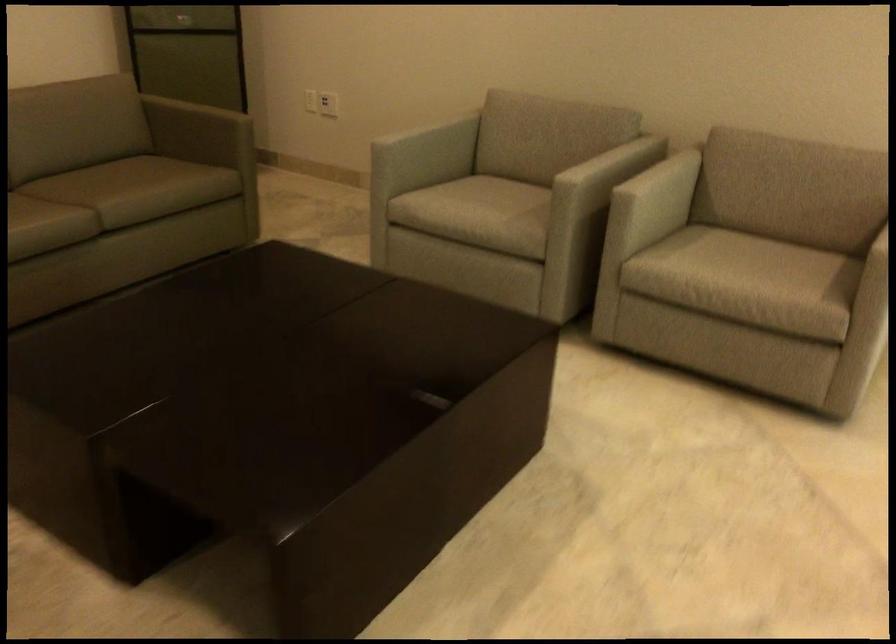
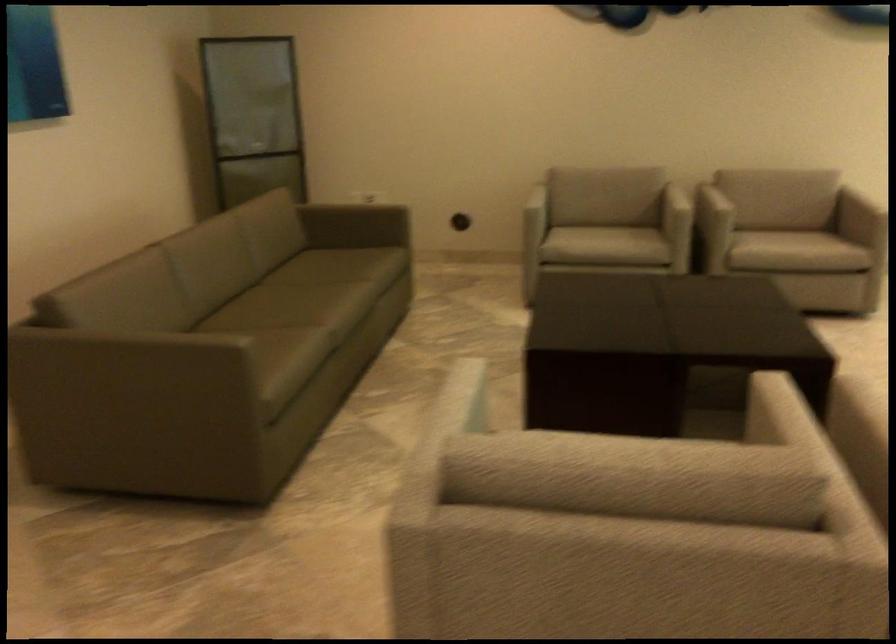
In the second image, find the point that corresponds to [661,187] in the first image.

(709, 201)